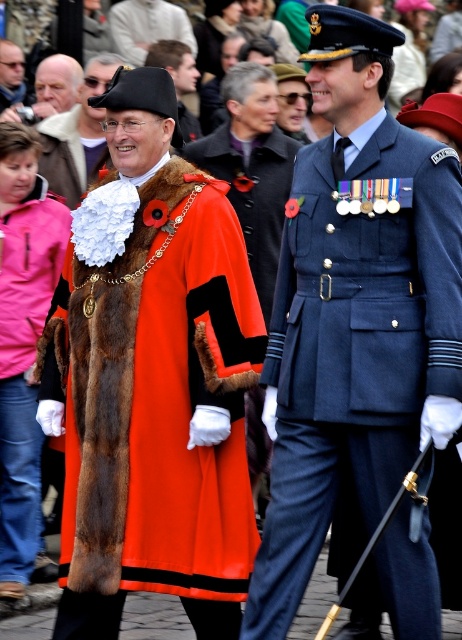
You are a photographer standing at the camera position. You need to take a closeup shot of the velvet red coat at center. Can you estimate how far you need to move forward to get the coat to fill the frame properly?

The velvet red coat at center is 148.99 feet from camera. To get a closeup, you would need to move closer, but the exact distance depends on the camera lens and sensor size. However, the current distance is quite far, so moving forward significantly would be necessary.

You are attending a formal event and need to determine which item is wider between the velvet red coat at center and the velvet red cape at center. Based on the description, which one is wider?

The velvet red coat at center is wider than the velvet red cape at center according to the description.

You are a photographer positioned at the origin point of the image coordinate system. You need to take a photo of the matte black uniform at center. What are the coordinates where you should aim your camera?

The coordinates to aim your camera are at point (354,310), as that is where the matte black uniform at center is located.